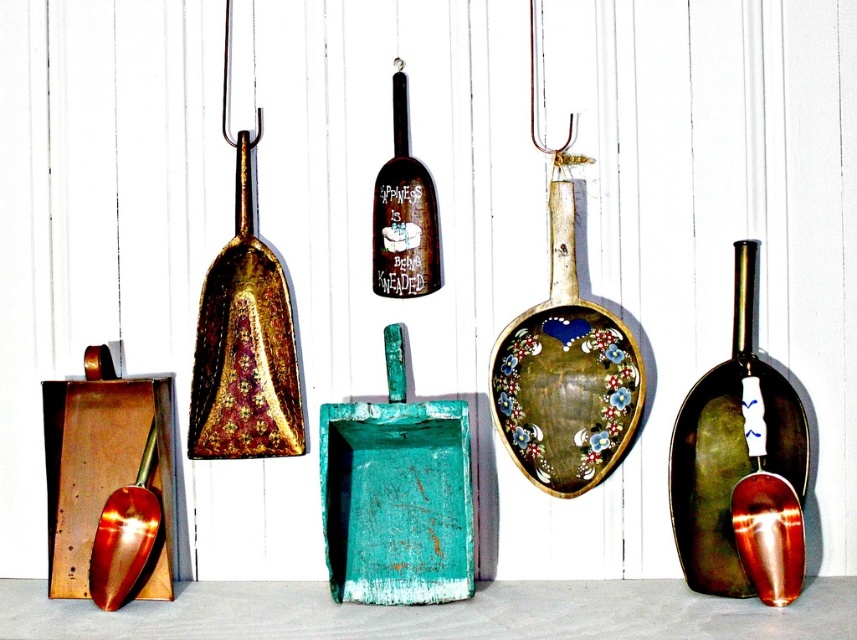
Question: Can you confirm if shiny metallic shovel at right is positioned below brushed gold shovel at lower left?

Choices:
 (A) no
 (B) yes

Answer: (A)

Question: Considering the relative positions of shiny metallic shovel at right and brushed gold shovel at lower left in the image provided, where is shiny metallic shovel at right located with respect to brushed gold shovel at lower left?

Choices:
 (A) above
 (B) below

Answer: (A)

Question: Which object appears closest to the camera in this image?

Choices:
 (A) brushed gold shovel at lower left
 (B) shiny metallic shovel at right

Answer: (B)

Question: Does shiny metallic shovel at right come in front of brushed gold shovel at lower left?

Choices:
 (A) no
 (B) yes

Answer: (B)